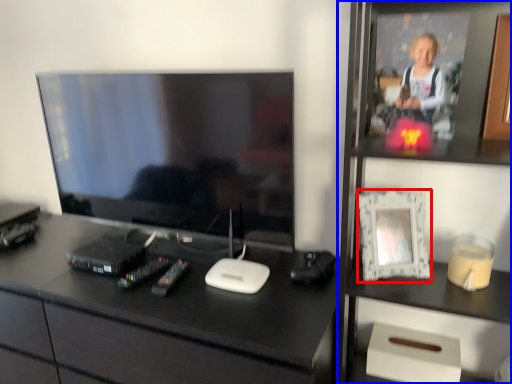
Question: Which object appears farthest to the camera in this image, picture frame (highlighted by a red box) or bookshelf (highlighted by a blue box)?

Choices:
 (A) picture frame
 (B) bookshelf

Answer: (A)